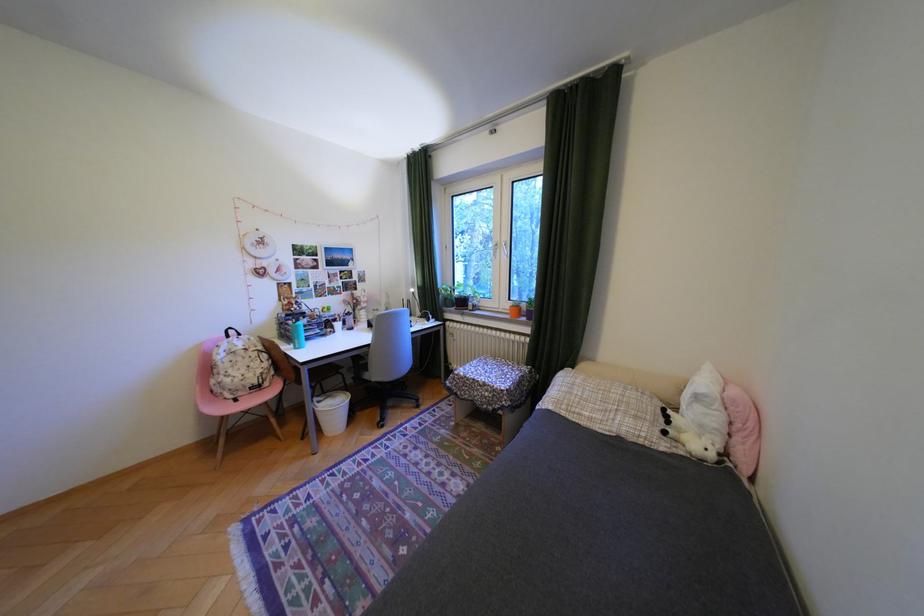
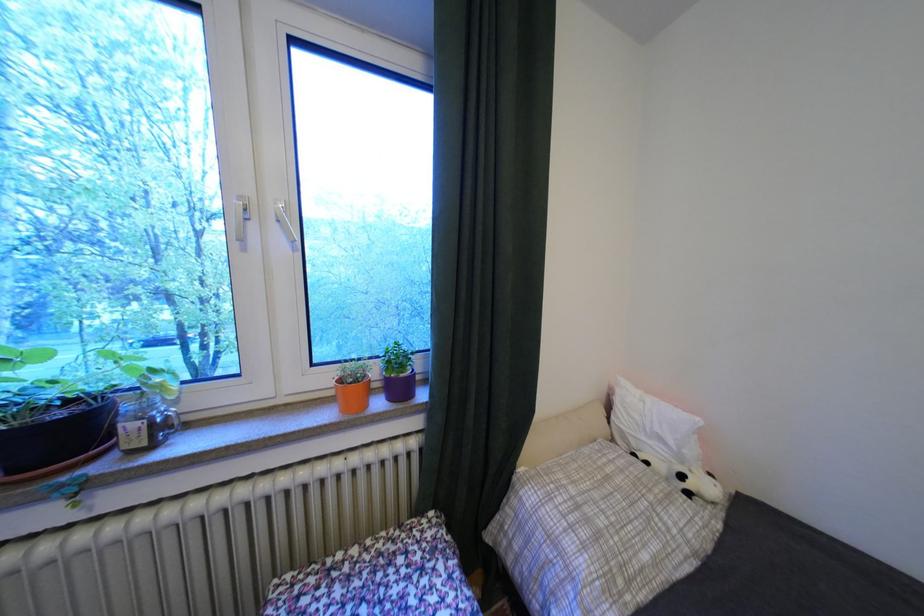
The point at (602,419) is marked in the first image. Where is the corresponding point in the second image?

(667, 562)